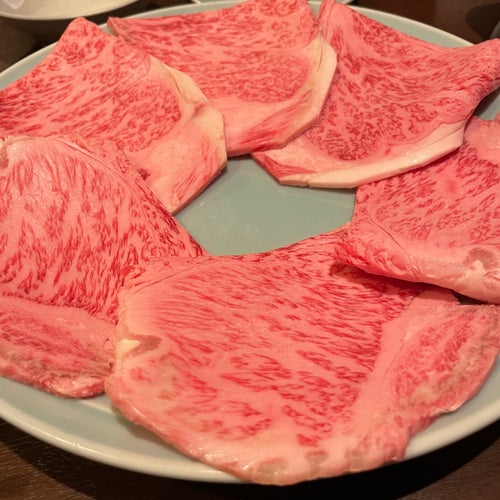
The image size is (500, 500). I want to click on part of a white plate in background, so click(x=44, y=6).